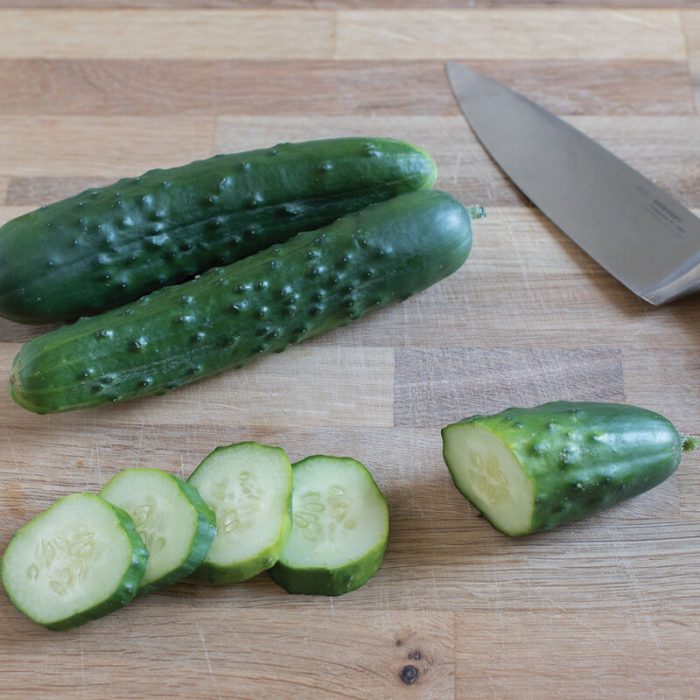
The height and width of the screenshot is (700, 700). In order to click on surface in this screenshot , I will do `click(477, 628)`.